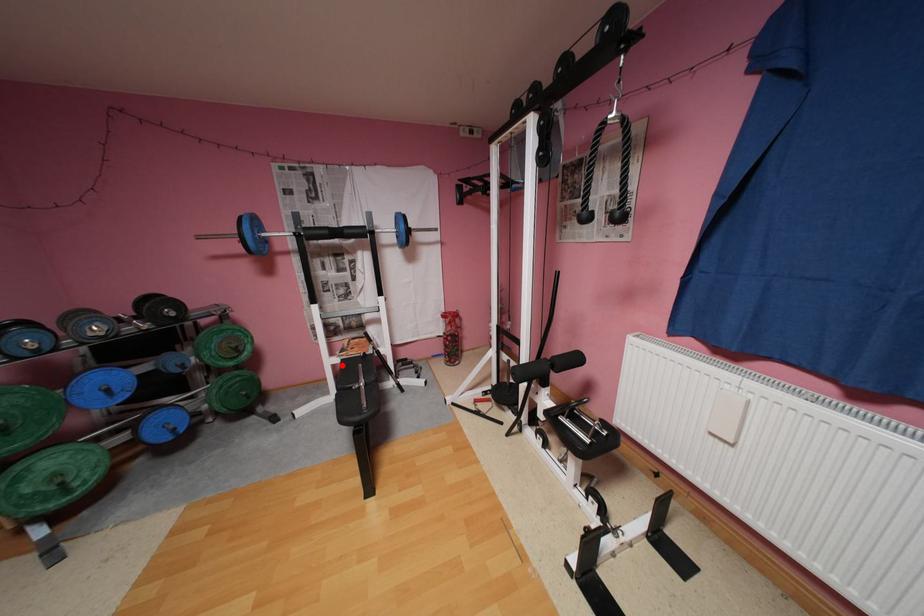
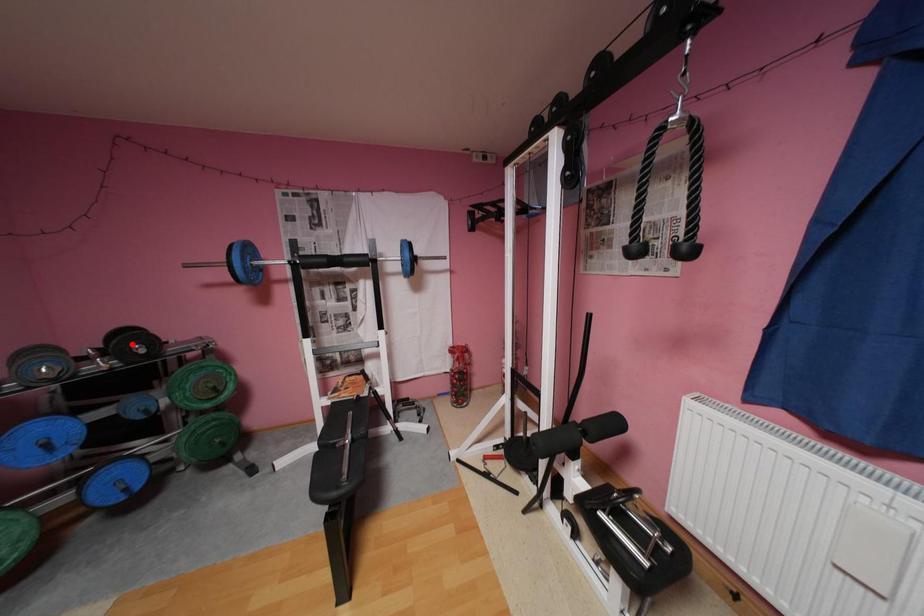
I am providing you with two images of the same scene from different viewpoints. A red point is marked on the first image and another point is marked on the second image. Does the point marked in image1 correspond to the same location as the one in image2?

No